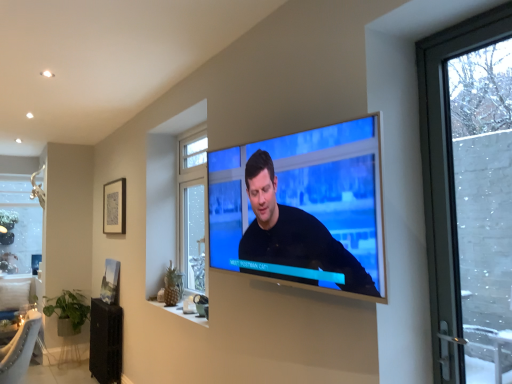
Question: Which direction should I rotate to face clear glass window at center, which is counted as the first window, starting from the front, — up or down?

Choices:
 (A) up
 (B) down

Answer: (B)

Question: Does clear glass window at center, positioned as the second window in back-to-front order, have a lesser height compared to matte black picture frame at lower left, which is the second picture frame from top to bottom?

Choices:
 (A) yes
 (B) no

Answer: (B)

Question: Is matte black picture frame at lower left, which ranks as the 1th picture frame in bottom-to-top order, at the back of clear glass window at center, which ranks as the 2th window in left-to-right order?

Choices:
 (A) no
 (B) yes

Answer: (A)

Question: Does clear glass window at center, which is counted as the first window, starting from the front, lie in front of matte black picture frame at lower left, which ranks as the 1th picture frame in bottom-to-top order?

Choices:
 (A) yes
 (B) no

Answer: (A)

Question: From the image's perspective, does clear glass window at center, which ranks as the 2th window in left-to-right order, appear lower than matte black picture frame at lower left, which is the second picture frame from top to bottom?

Choices:
 (A) no
 (B) yes

Answer: (A)

Question: Is clear glass window at center, which is counted as the first window, starting from the front, behind matte black picture frame at lower left, which ranks as the 1th picture frame in bottom-to-top order?

Choices:
 (A) no
 (B) yes

Answer: (A)

Question: From the image's perspective, is clear glass window at center, marked as the 1th window in a right-to-left arrangement, located above matte black picture frame at lower left, which is the second picture frame from top to bottom?

Choices:
 (A) no
 (B) yes

Answer: (B)

Question: Is matte black picture frame at upper left, which is the 1th picture frame from top to bottom, in front of matte black picture frame at lower left, which ranks as the 1th picture frame in bottom-to-top order?

Choices:
 (A) no
 (B) yes

Answer: (B)

Question: Is matte black picture frame at upper left, which is the 1th picture frame from top to bottom, positioned with its back to matte black picture frame at lower left, which ranks as the 1th picture frame in bottom-to-top order?

Choices:
 (A) no
 (B) yes

Answer: (A)

Question: Does matte black picture frame at upper left, which is the 1th picture frame from top to bottom, have a greater height compared to matte black picture frame at lower left, which ranks as the 1th picture frame in bottom-to-top order?

Choices:
 (A) no
 (B) yes

Answer: (B)

Question: Is matte black picture frame at lower left, which is the second picture frame from top to bottom, completely or partially inside matte black picture frame at upper left, which is the 1th picture frame from top to bottom?

Choices:
 (A) yes
 (B) no

Answer: (B)

Question: From the image's perspective, is matte black picture frame at upper left, which appears as the 2th picture frame when ordered from the bottom, located beneath matte black picture frame at lower left, which ranks as the 1th picture frame in bottom-to-top order?

Choices:
 (A) yes
 (B) no

Answer: (B)

Question: Can you confirm if matte black picture frame at upper left, which appears as the 2th picture frame when ordered from the bottom, is wider than matte black picture frame at lower left, which is the second picture frame from top to bottom?

Choices:
 (A) no
 (B) yes

Answer: (A)

Question: Is matte black picture frame at upper left, which is the 1th picture frame from top to bottom, smaller than matte black tv at center?

Choices:
 (A) no
 (B) yes

Answer: (B)